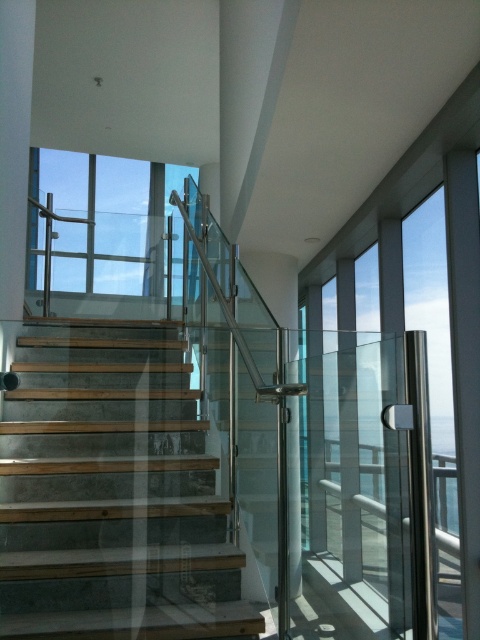
Question: Considering the relative positions of wooden steps at center and transparent glass window at upper center in the image provided, where is wooden steps at center located with respect to transparent glass window at upper center?

Choices:
 (A) right
 (B) left

Answer: (A)

Question: Does wooden steps at center appear over transparent glass window at upper center?

Choices:
 (A) no
 (B) yes

Answer: (A)

Question: Which of the following is the closest to the observer?

Choices:
 (A) transparent glass window at upper center
 (B) wooden steps at center

Answer: (B)

Question: Which of the following is the closest to the observer?

Choices:
 (A) transparent glass window at upper center
 (B) wooden steps at center

Answer: (B)

Question: Can you confirm if wooden steps at center is positioned to the right of transparent glass window at upper center?

Choices:
 (A) no
 (B) yes

Answer: (B)